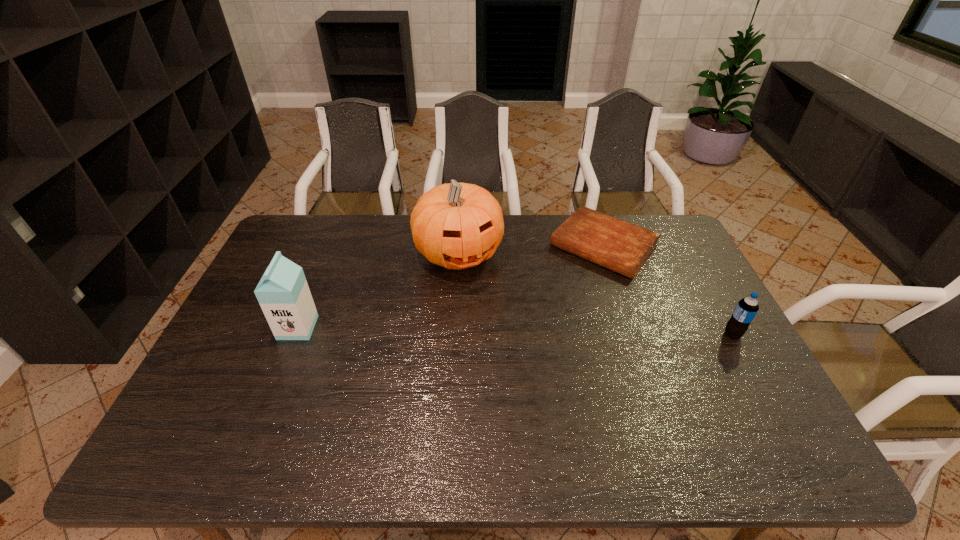
Locate an element on the screen. Image resolution: width=960 pixels, height=540 pixels. free space between the leftmost object and the pumpkin is located at coordinates (378, 291).

Identify the location of vacant area that lies between the second object from right to left and the pumpkin. Image resolution: width=960 pixels, height=540 pixels. (531, 250).

Image resolution: width=960 pixels, height=540 pixels. Find the location of `free space between the shortest object and the rightmost object`. free space between the shortest object and the rightmost object is located at coordinates (668, 291).

You are a GUI agent. You are given a task and a screenshot of the screen. Output one action in this format:
    pyautogui.click(x=<x>, y=<y>)
    Task: Click on the free spot between the second shortest object and the milk carton
    The height and width of the screenshot is (540, 960).
    Given the screenshot: What is the action you would take?
    pyautogui.click(x=516, y=331)

Locate an element on the screen. The width and height of the screenshot is (960, 540). free space between the leftmost object and the shortest object is located at coordinates (450, 287).

Locate an element on the screen. This screenshot has width=960, height=540. vacant region between the milk carton and the pumpkin is located at coordinates (378, 291).

Where is `free space that is in between the soda bottle and the third object from right to left`? free space that is in between the soda bottle and the third object from right to left is located at coordinates (595, 294).

Image resolution: width=960 pixels, height=540 pixels. I want to click on vacant area that lies between the soda bottle and the leftmost object, so click(x=516, y=331).

Image resolution: width=960 pixels, height=540 pixels. I want to click on empty location between the third object from right to left and the rightmost object, so click(595, 294).

Point out which object is positioned as the third nearest to the pumpkin. Please provide its 2D coordinates. Your answer should be formatted as a tuple, i.e. [(x, y)], where the tuple contains the x and y coordinates of a point satisfying the conditions above.

[(746, 309)]